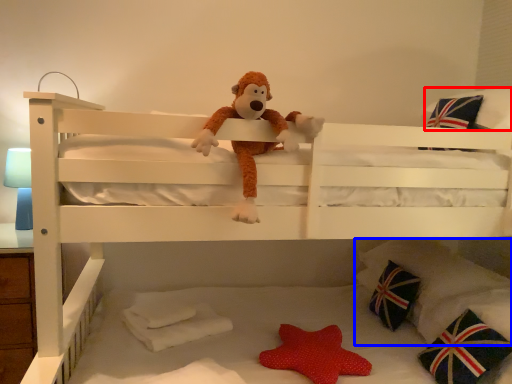
Question: Among these objects, which one is nearest to the camera, pillow (highlighted by a red box) or pillow (highlighted by a blue box)?

Choices:
 (A) pillow
 (B) pillow

Answer: (A)